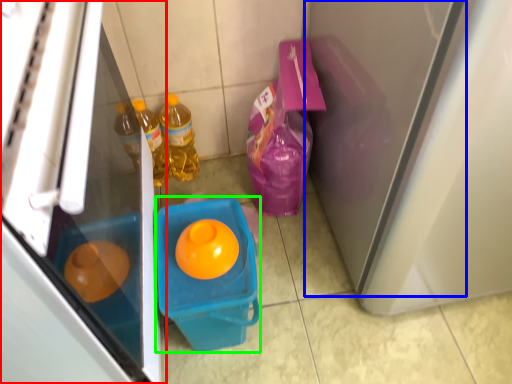
Question: Which is nearer to the refrigerator (highlighted by a red box)? screen door (highlighted by a blue box) or recycling bin (highlighted by a green box).

Choices:
 (A) screen door
 (B) recycling bin

Answer: (B)